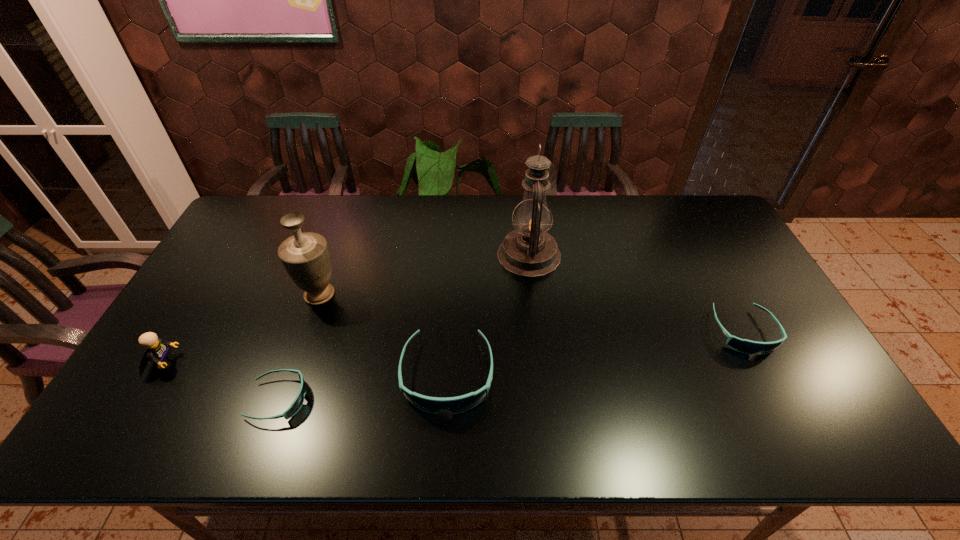
Image resolution: width=960 pixels, height=540 pixels. I want to click on urn, so click(305, 256).

Locate an element on the screen. The width and height of the screenshot is (960, 540). vacant space situated 0.290m on the front-facing side of the shortest object is located at coordinates (427, 400).

Image resolution: width=960 pixels, height=540 pixels. What are the coordinates of `vacant point located on the front-facing side of the rightmost object` in the screenshot? It's located at (774, 388).

This screenshot has height=540, width=960. In order to click on vacant space located 0.300m on the left of the tallest object in this screenshot , I will do `click(405, 255)`.

The image size is (960, 540). I want to click on free space located on the front-facing side of the leftmost object, so click(305, 362).

Identify the location of vacant space situated on the back of the urn. This screenshot has height=540, width=960. (350, 206).

What are the coordinates of `object that is at the far edge` in the screenshot? It's located at (529, 251).

Where is `Lego present at the near edge`? This screenshot has width=960, height=540. Lego present at the near edge is located at coordinates (157, 351).

Identify the location of object that is at the left edge. This screenshot has height=540, width=960. (x=157, y=351).

This screenshot has width=960, height=540. What are the coordinates of `object situated at the right edge` in the screenshot? It's located at click(744, 346).